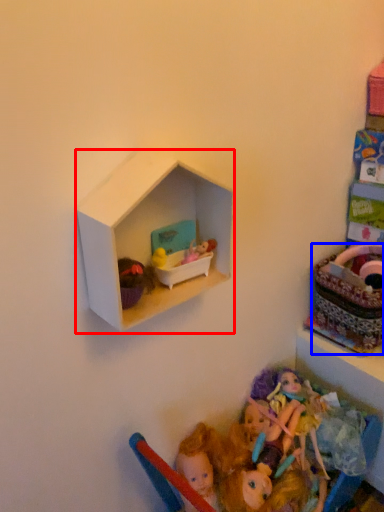
Question: Which of the following is the farthest to the observer, shelf (highlighted by a red box) or basket (highlighted by a blue box)?

Choices:
 (A) shelf
 (B) basket

Answer: (B)